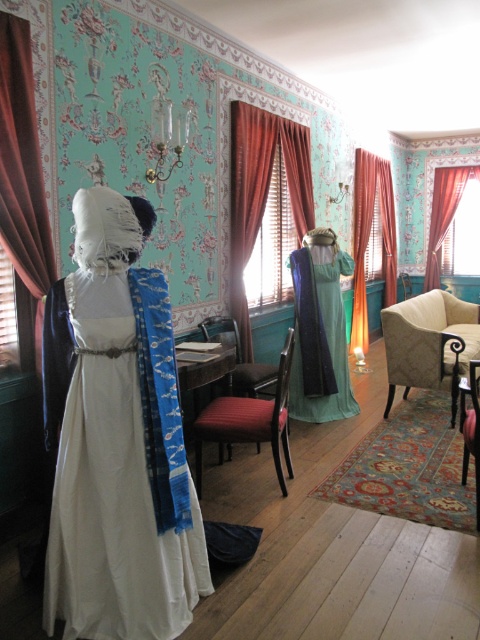
Question: Among these objects, which one is nearest to the camera?

Choices:
 (A) velvet curtain at right
 (B) teal fabric dress at center
 (C) matte orange curtain at center
 (D) velvet dark red curtain at left

Answer: (D)

Question: Can you confirm if velvet burgundy curtain at center is positioned to the right of velvet beige armchair at center?

Choices:
 (A) yes
 (B) no

Answer: (B)

Question: Is white satin dress at left further to camera compared to velvet curtain at right?

Choices:
 (A) no
 (B) yes

Answer: (A)

Question: Does velvet dark red curtain at left appear under teal fabric dress at center?

Choices:
 (A) yes
 (B) no

Answer: (B)

Question: Which point appears closest to the camera in this image?

Choices:
 (A) (384, 256)
 (B) (463, 456)
 (C) (197, 435)
 (D) (444, 298)

Answer: (C)

Question: Which point is closer to the camera?

Choices:
 (A) (385, 285)
 (B) (391, 248)

Answer: (B)